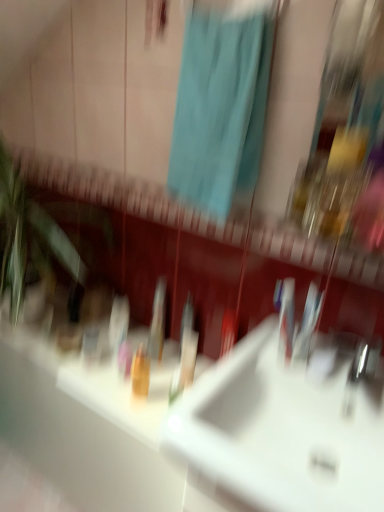
Question: Is teal fabric shower curtain at upper center further to camera compared to translucent orange bottle at center?

Choices:
 (A) yes
 (B) no

Answer: (B)

Question: From a real-world perspective, is teal fabric shower curtain at upper center under translucent orange bottle at center?

Choices:
 (A) yes
 (B) no

Answer: (B)

Question: Can you confirm if teal fabric shower curtain at upper center is bigger than translucent orange bottle at center?

Choices:
 (A) yes
 (B) no

Answer: (A)

Question: Does teal fabric shower curtain at upper center have a smaller size compared to translucent orange bottle at center?

Choices:
 (A) yes
 (B) no

Answer: (B)

Question: Can you confirm if teal fabric shower curtain at upper center is thinner than translucent orange bottle at center?

Choices:
 (A) no
 (B) yes

Answer: (A)

Question: Based on their sizes in the image, would you say translucent plastic toothbrush at center is bigger or smaller than teal fabric shower curtain at upper center?

Choices:
 (A) big
 (B) small

Answer: (B)

Question: From the image's perspective, is translucent plastic toothbrush at center above or below teal fabric shower curtain at upper center?

Choices:
 (A) above
 (B) below

Answer: (B)

Question: Considering the positions of translucent plastic toothbrush at center and teal fabric shower curtain at upper center in the image, is translucent plastic toothbrush at center wider or thinner than teal fabric shower curtain at upper center?

Choices:
 (A) thin
 (B) wide

Answer: (A)

Question: Is translucent plastic toothbrush at center in front of or behind teal fabric shower curtain at upper center in the image?

Choices:
 (A) behind
 (B) front

Answer: (A)

Question: Is translucent orange bottle at center taller or shorter than translucent plastic toothbrush at center?

Choices:
 (A) short
 (B) tall

Answer: (A)

Question: Would you say translucent orange bottle at center is inside or outside translucent plastic toothbrush at center?

Choices:
 (A) outside
 (B) inside

Answer: (A)

Question: In terms of size, does translucent orange bottle at center appear bigger or smaller than translucent plastic toothbrush at center?

Choices:
 (A) small
 (B) big

Answer: (A)

Question: In the image, is translucent orange bottle at center positioned in front of or behind translucent plastic toothbrush at center?

Choices:
 (A) behind
 (B) front

Answer: (B)

Question: Considering the relative positions of teal fabric shower curtain at upper center and translucent orange bottle at center in the image provided, is teal fabric shower curtain at upper center to the left or to the right of translucent orange bottle at center?

Choices:
 (A) right
 (B) left

Answer: (A)

Question: Considering the positions of teal fabric shower curtain at upper center and translucent orange bottle at center in the image, is teal fabric shower curtain at upper center bigger or smaller than translucent orange bottle at center?

Choices:
 (A) big
 (B) small

Answer: (A)